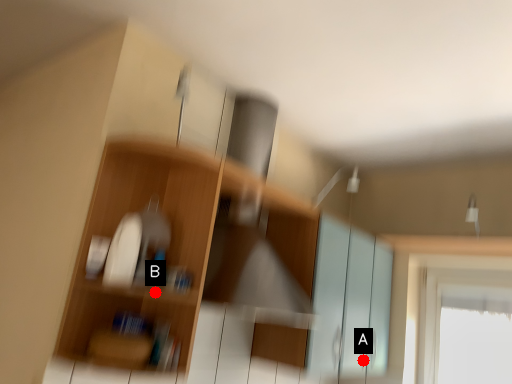
Question: Two points are circled on the image, labeled by A and B beside each circle. Which point appears closest to the camera in this image?

Choices:
 (A) A is closer
 (B) B is closer

Answer: (B)